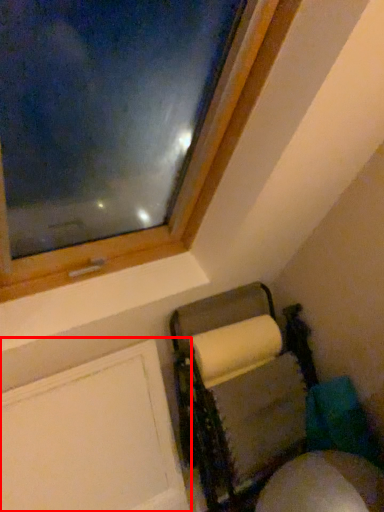
Question: From the image, what is the correct spatial relationship of screen door (annotated by the red box) in relation to furniture?

Choices:
 (A) left
 (B) right

Answer: (A)